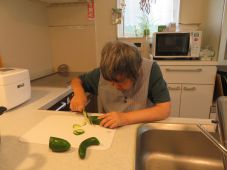
Image resolution: width=227 pixels, height=170 pixels. I want to click on white wall left of man, so click(x=26, y=31).